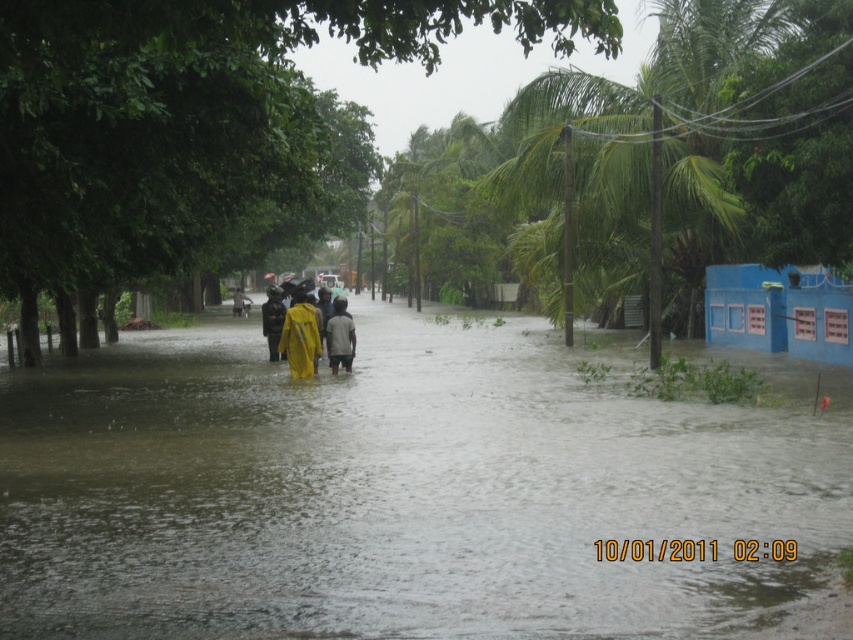
Question: Estimate the real-world distances between objects in this image. Which object is farther from the brown murky water at center?

Choices:
 (A) yellow matte jacket at center
 (B) light brown fabric jacket at center
 (C) yellow waterproof jacket at center
 (D) yellow matte raincoat at center

Answer: (A)

Question: Which of the following is the closest to the observer?

Choices:
 (A) yellow waterproof jacket at center
 (B) light brown fabric jacket at center

Answer: (B)

Question: Can you confirm if yellow waterproof jacket at center is positioned to the right of light brown fabric jacket at center?

Choices:
 (A) no
 (B) yes

Answer: (A)

Question: Is yellow matte raincoat at center below yellow matte jacket at center?

Choices:
 (A) no
 (B) yes

Answer: (B)

Question: Which object is farther from the camera taking this photo?

Choices:
 (A) yellow matte raincoat at center
 (B) light brown fabric jacket at center

Answer: (A)

Question: Can you confirm if light brown fabric jacket at center is thinner than yellow matte jacket at center?

Choices:
 (A) no
 (B) yes

Answer: (B)